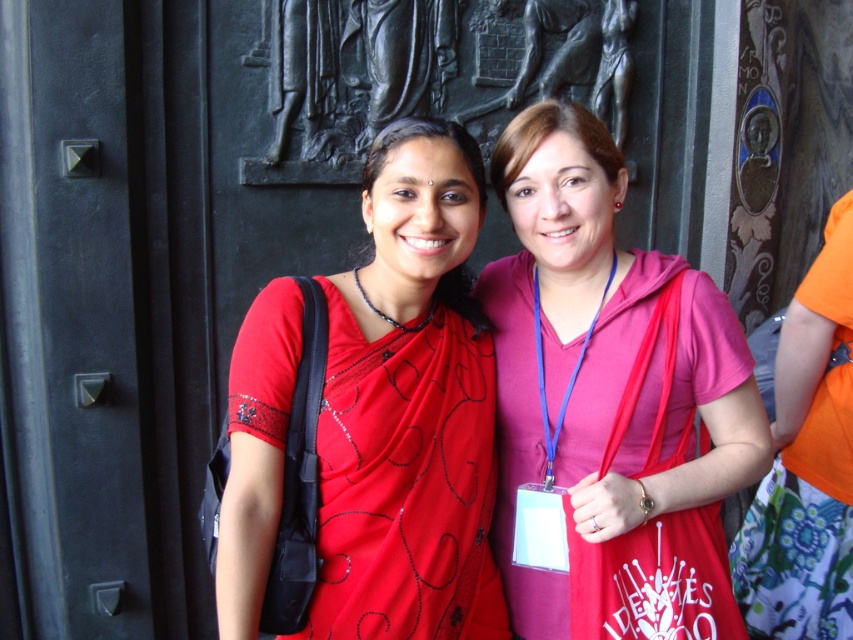
Question: Does pink fabric at center appear on the right side of black metal door at center?

Choices:
 (A) yes
 (B) no

Answer: (A)

Question: Which point appears farthest from the camera in this image?

Choices:
 (A) (486, 525)
 (B) (202, 356)

Answer: (B)

Question: Does matte red sari at center come behind black metal door at center?

Choices:
 (A) yes
 (B) no

Answer: (B)

Question: Is pink fabric at center positioned in front of black metal door at center?

Choices:
 (A) yes
 (B) no

Answer: (A)

Question: Which point is closer to the camera?

Choices:
 (A) (228, 163)
 (B) (543, 573)
 (C) (347, 394)

Answer: (C)

Question: Which object is farther from the camera taking this photo?

Choices:
 (A) matte red sari at center
 (B) pink fabric at center

Answer: (B)